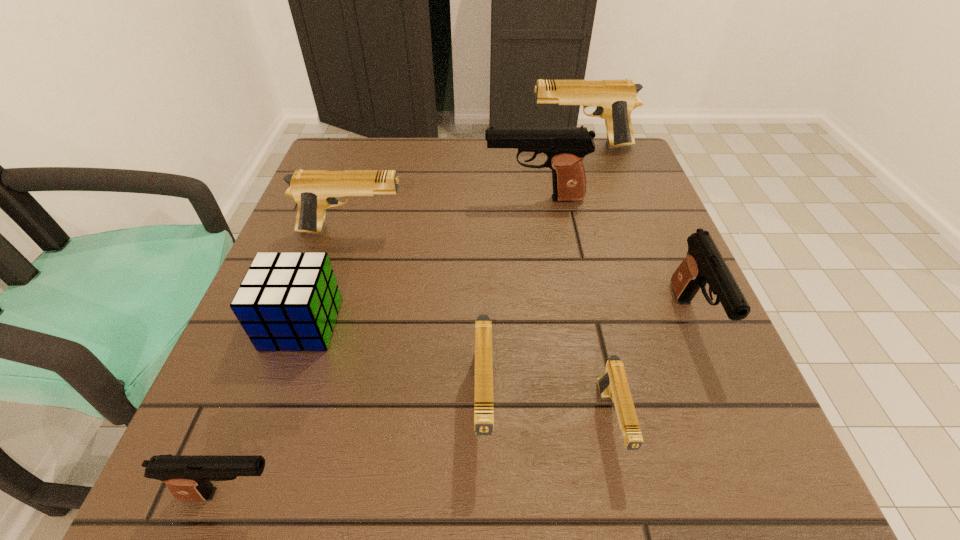
What are the coordinates of `free space located 0.090m at the barrel of the third farthest object` in the screenshot? It's located at (448, 231).

Locate an element on the screen. This screenshot has height=540, width=960. vacant position located at the barrel of the second biggest black pistol is located at coordinates (735, 423).

I want to click on free space located on the right of the red cube, so click(x=547, y=324).

Find the location of a particular element. vacant space located 0.350m at the barrel of the nearest black pistol is located at coordinates (562, 494).

Locate an element on the screen. object that is at the far edge is located at coordinates (615, 99).

Where is `cube at the left edge`? cube at the left edge is located at coordinates [289, 301].

This screenshot has width=960, height=540. I want to click on object positioned at the near left corner, so click(188, 478).

I want to click on object that is at the far right corner, so click(615, 99).

In the image, there is a desktop. Where is `vacant space at the far edge`? vacant space at the far edge is located at coordinates (386, 166).

This screenshot has height=540, width=960. Identify the location of vacant region at the near edge of the desktop. (561, 463).